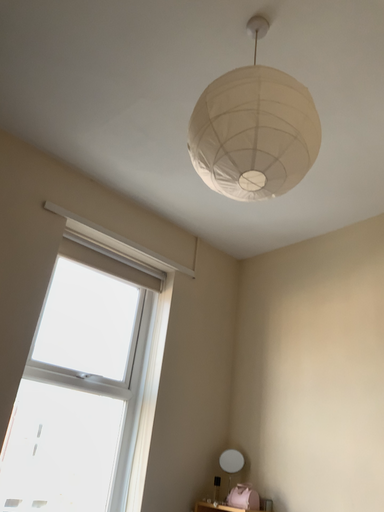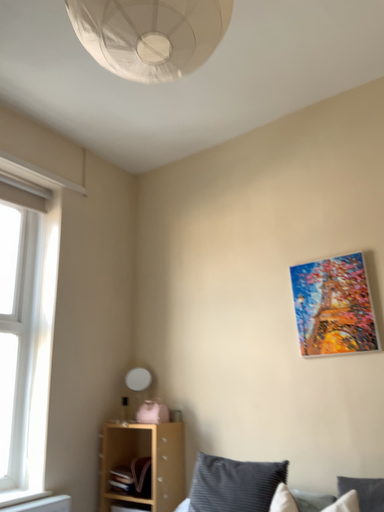
Question: Which way did the camera rotate in the video?

Choices:
 (A) rotated downward
 (B) rotated upward

Answer: (A)